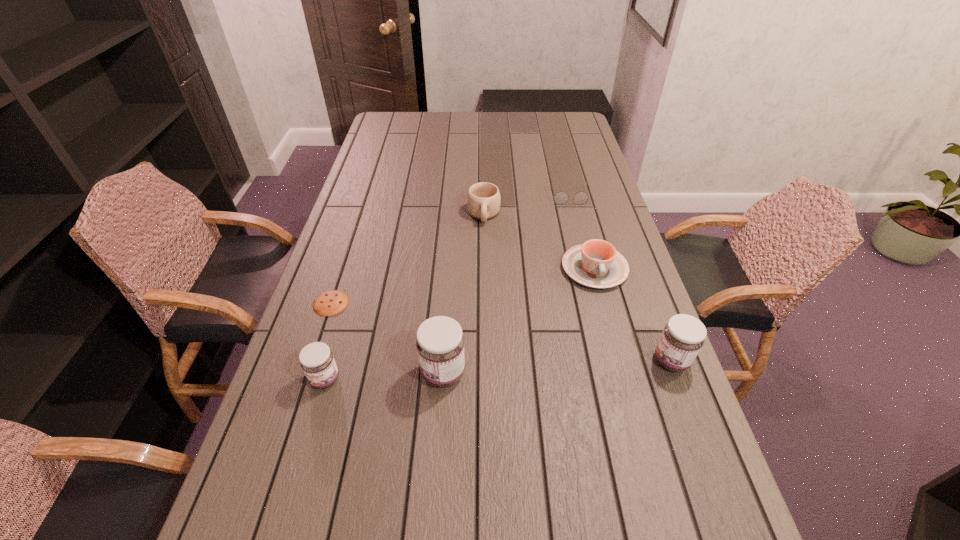
Locate an element on the screen. the shortest jam is located at coordinates (316, 359).

At what (x,y) coordinates should I click in order to perform the action: click on the tallest jam. Please return your answer as a coordinate pair (x, y). The height and width of the screenshot is (540, 960). Looking at the image, I should click on (440, 343).

At what (x,y) coordinates should I click in order to perform the action: click on the second jam from left to right. Please return your answer as a coordinate pair (x, y). Looking at the image, I should click on (440, 343).

Find the location of a particular element. This screenshot has height=540, width=960. the second tallest jam is located at coordinates (683, 336).

Find the location of `the rightmost jam`. the rightmost jam is located at coordinates (683, 336).

Identify the location of the sixth tallest object. (561, 197).

This screenshot has width=960, height=540. Identify the location of the shortest object. (332, 302).

The width and height of the screenshot is (960, 540). Identify the location of mug. (483, 199).

In order to click on the fifth tallest object in this screenshot , I will do `click(595, 263)`.

Where is `vacant region located on the front label of the leftmost jam`? This screenshot has height=540, width=960. vacant region located on the front label of the leftmost jam is located at coordinates (293, 488).